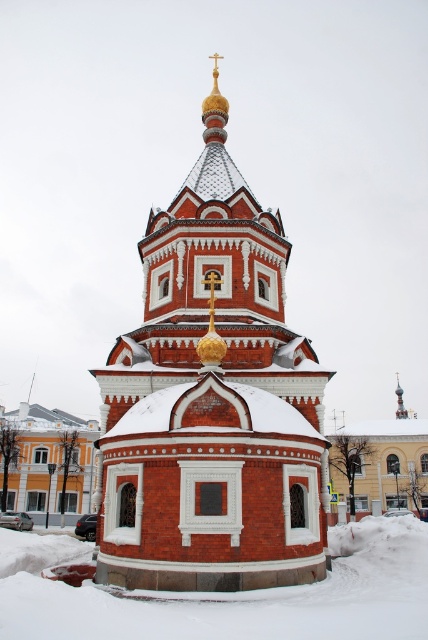
Question: Does red brick church steeple at center appear on the left side of white powdery snow at lower center?

Choices:
 (A) no
 (B) yes

Answer: (A)

Question: Is red brick church steeple at center behind white powdery snow at lower center?

Choices:
 (A) no
 (B) yes

Answer: (B)

Question: Which object is closer to the camera taking this photo?

Choices:
 (A) red brick church steeple at center
 (B) white powdery snow at lower center

Answer: (B)

Question: Can you confirm if red brick church steeple at center is positioned above white powdery snow at lower center?

Choices:
 (A) no
 (B) yes

Answer: (B)

Question: Which of the following is the farthest from the observer?

Choices:
 (A) white powdery snow at lower center
 (B) red brick church steeple at center

Answer: (B)